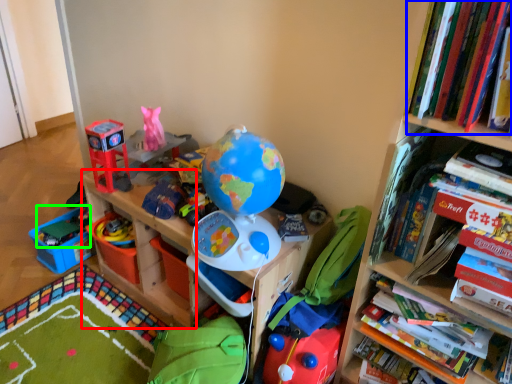
Question: Which object is positioned farthest from shelf (highlighted by a red box)? Select from book (highlighted by a blue box) and toy (highlighted by a green box).

Choices:
 (A) book
 (B) toy

Answer: (A)